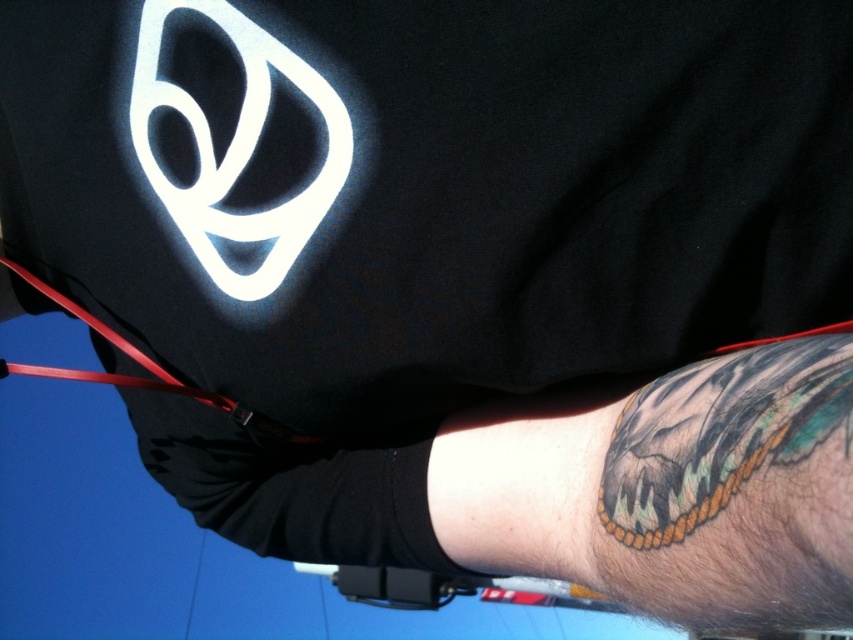
Question: Is black matte shirt at center behind rubber strap at lower left?

Choices:
 (A) no
 (B) yes

Answer: (A)

Question: Which point appears closest to the camera in this image?

Choices:
 (A) (599, 515)
 (B) (701, 432)

Answer: (B)

Question: Is the position of black tattooed skin at lower right more distant than that of rubber strap at lower left?

Choices:
 (A) no
 (B) yes

Answer: (A)

Question: Which of the following is the closest to the observer?

Choices:
 (A) (77, 308)
 (B) (671, 515)
 (C) (787, 225)
 (D) (751, 428)

Answer: (D)

Question: Based on their relative distances, which object is nearer to the black matte shirt at center?

Choices:
 (A) black tattooed skin at lower right
 (B) multicolored ink butterfly at lower right

Answer: (A)

Question: Is black tattooed skin at lower right thinner than rubber strap at lower left?

Choices:
 (A) no
 (B) yes

Answer: (A)